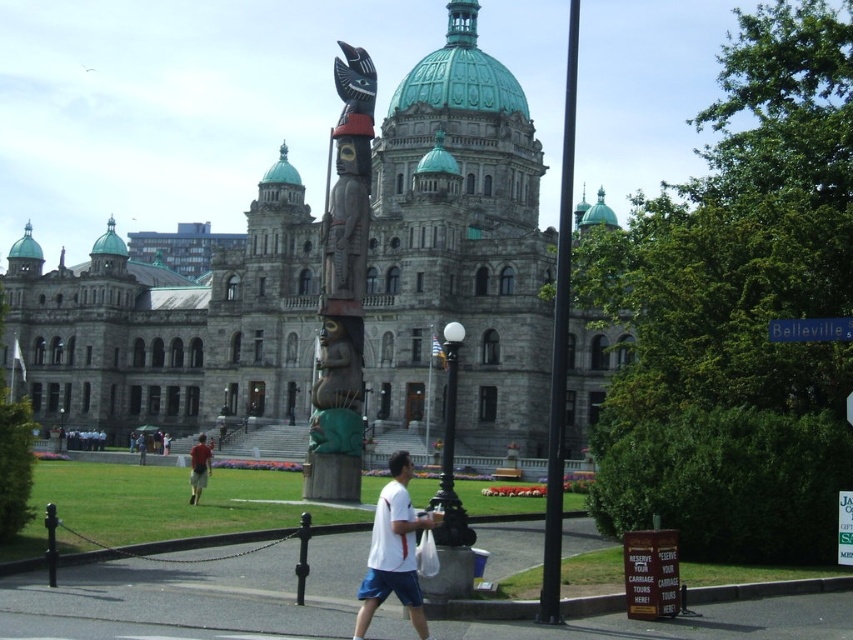
Between smooth black pole at center and black glass lamp post at center, which one has less height?

Standing shorter between the two is black glass lamp post at center.

From the picture: Which is below, smooth black pole at center or black glass lamp post at center?

black glass lamp post at center is below.

You are a GUI agent. You are given a task and a screenshot of the screen. Output one action in this format:
    pyautogui.click(x=<x>, y=<y>)
    Task: Click on the smooth black pole at center
    
    Given the screenshot: What is the action you would take?
    pyautogui.click(x=560, y=346)

Can you confirm if smooth black pole at center is wider than green plastic street sign at upper right?

Indeed, smooth black pole at center has a greater width compared to green plastic street sign at upper right.

Does smooth black pole at center come behind green plastic street sign at upper right?

No.

Which is in front, point (572, 186) or point (770, 337)?

Positioned in front is point (770, 337).

Locate an element on the screen. The image size is (853, 640). smooth black pole at center is located at coordinates (560, 346).

Based on the photo, does white cotton shirt at center have a smaller size compared to light brown fabric pants at center?

No, white cotton shirt at center is not smaller than light brown fabric pants at center.

Does white cotton shirt at center have a larger size compared to light brown fabric pants at center?

Yes, white cotton shirt at center is bigger than light brown fabric pants at center.

Is point (405, 488) positioned before point (206, 465)?

Yes, point (405, 488) is in front of point (206, 465).

In order to click on white cotton shirt at center in this screenshot , I will do `click(393, 550)`.